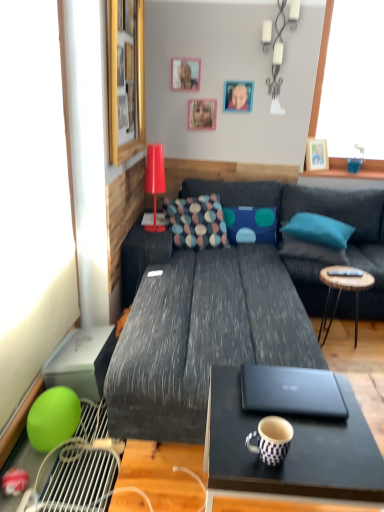
Question: Can wooden picture frame at upper right, the fourth picture frame positioned from the left, be found inside blue fabric portrait at upper center?

Choices:
 (A) no
 (B) yes

Answer: (A)

Question: Can you confirm if blue fabric portrait at upper center is shorter than wooden picture frame at upper right, the fourth picture frame from the front?

Choices:
 (A) no
 (B) yes

Answer: (B)

Question: Considering the relative positions of blue fabric portrait at upper center and wooden picture frame at upper right, the fourth picture frame positioned from the left, in the image provided, is blue fabric portrait at upper center to the left of wooden picture frame at upper right, the fourth picture frame positioned from the left, from the viewer's perspective?

Choices:
 (A) yes
 (B) no

Answer: (A)

Question: From the image's perspective, is blue fabric portrait at upper center below wooden picture frame at upper right, which ranks as the 1th picture frame in right-to-left order?

Choices:
 (A) no
 (B) yes

Answer: (A)

Question: From a real-world perspective, is blue fabric portrait at upper center below wooden picture frame at upper right, the fourth picture frame positioned from the left?

Choices:
 (A) yes
 (B) no

Answer: (B)

Question: Is teal fabric pillow at center, positioned as the fourth pillow in left-to-right order, taller or shorter than wooden picture frame at upper right, the fourth picture frame positioned from the left?

Choices:
 (A) short
 (B) tall

Answer: (A)

Question: Relative to wooden picture frame at upper right, the fourth picture frame from the front, is teal fabric pillow at center, positioned as the fourth pillow in left-to-right order, in front or behind?

Choices:
 (A) behind
 (B) front

Answer: (B)

Question: Do you think teal fabric pillow at center, positioned as the fourth pillow in left-to-right order, is within wooden picture frame at upper right, acting as the 1th picture frame starting from the back, or outside of it?

Choices:
 (A) outside
 (B) inside

Answer: (A)

Question: Is point (322, 226) closer or farther from the camera than point (327, 167)?

Choices:
 (A) farther
 (B) closer

Answer: (B)

Question: Is point [317, 230] closer or farther from the camera than point [238, 103]?

Choices:
 (A) farther
 (B) closer

Answer: (B)

Question: Considering the positions of teal fabric pillow at center, positioned as the fourth pillow in left-to-right order, and blue fabric portrait at upper center in the image, is teal fabric pillow at center, positioned as the fourth pillow in left-to-right order, taller or shorter than blue fabric portrait at upper center?

Choices:
 (A) short
 (B) tall

Answer: (A)

Question: Looking at their shapes, would you say teal fabric pillow at center, positioned as the fourth pillow in left-to-right order, is wider or thinner than blue fabric portrait at upper center?

Choices:
 (A) wide
 (B) thin

Answer: (A)

Question: Is teal fabric pillow at center, which is counted as the 1th pillow, starting from the right, in front of or behind blue fabric portrait at upper center in the image?

Choices:
 (A) front
 (B) behind

Answer: (A)

Question: Relative to wooden round table at right, is blue fabric pillow at center, arranged as the 2th pillow when viewed from the left, in front or behind?

Choices:
 (A) behind
 (B) front

Answer: (A)

Question: From a real-world perspective, relative to wooden round table at right, is blue fabric pillow at center, acting as the 3th pillow starting from the right, vertically above or below?

Choices:
 (A) below
 (B) above

Answer: (B)